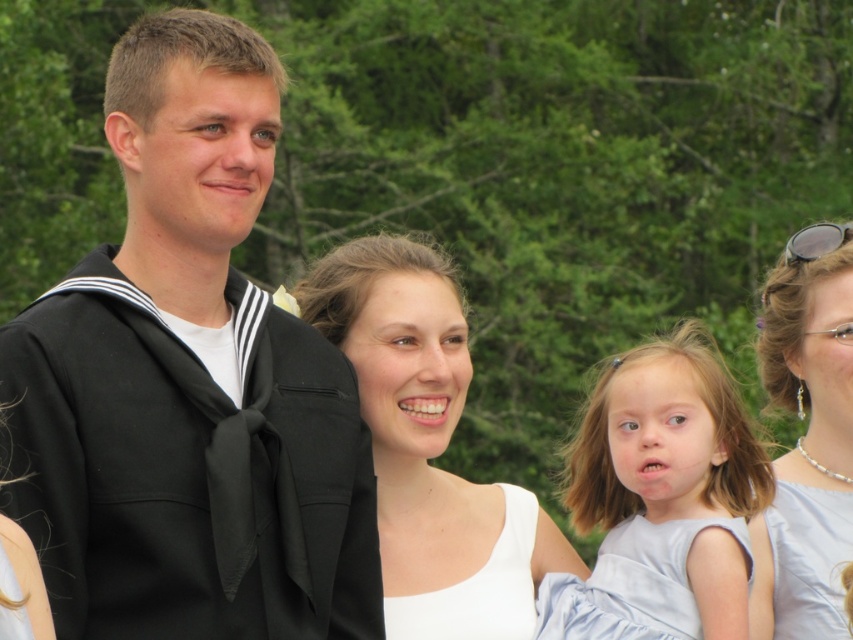
You are a photographer at a formal event and need to position two guests wearing the white satin dress at center and the light blue satin dress at lower right for a group photo. Based on their current positions, which dress is positioned to the left of the other?

The white satin dress at center is positioned to the left of the light blue satin dress at lower right.

You are standing at the origin point in the image. Which direction should you move to reach the light blue fabric dress at lower right?

Since the light blue fabric dress at lower right is located at point 0.781 on the x and y axis, you should move towards the lower right direction to reach it.